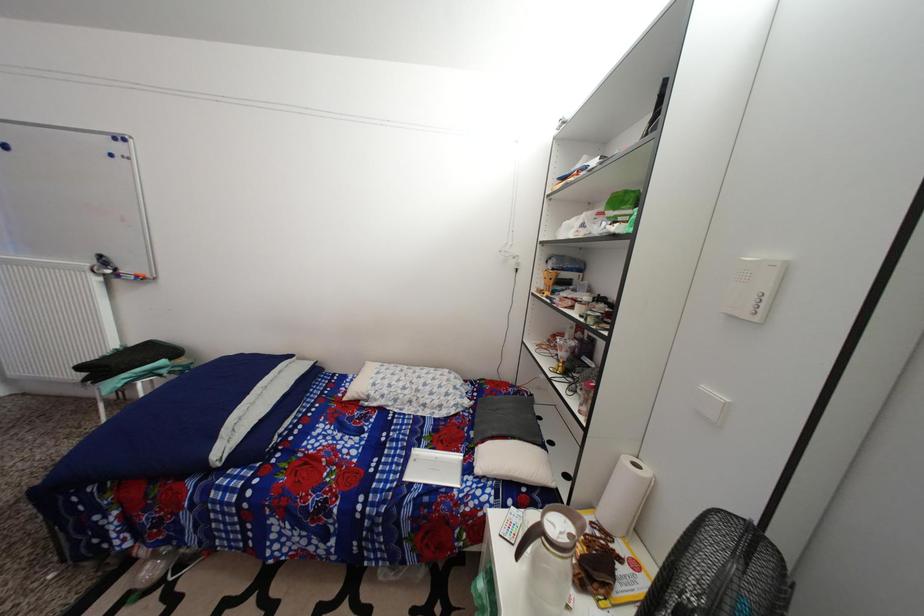
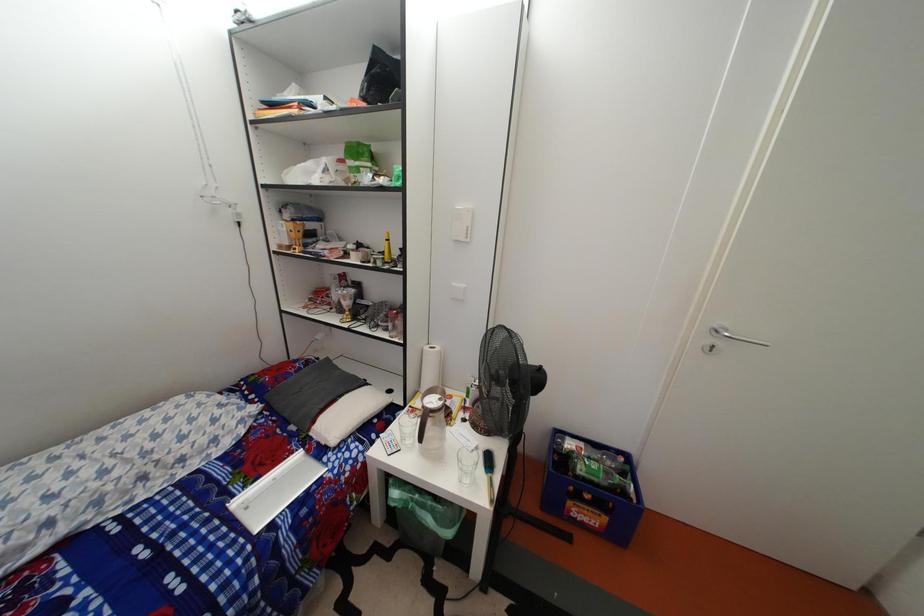
First-person continuous shooting, in which direction is the camera rotating?

The camera rotated toward right-down.